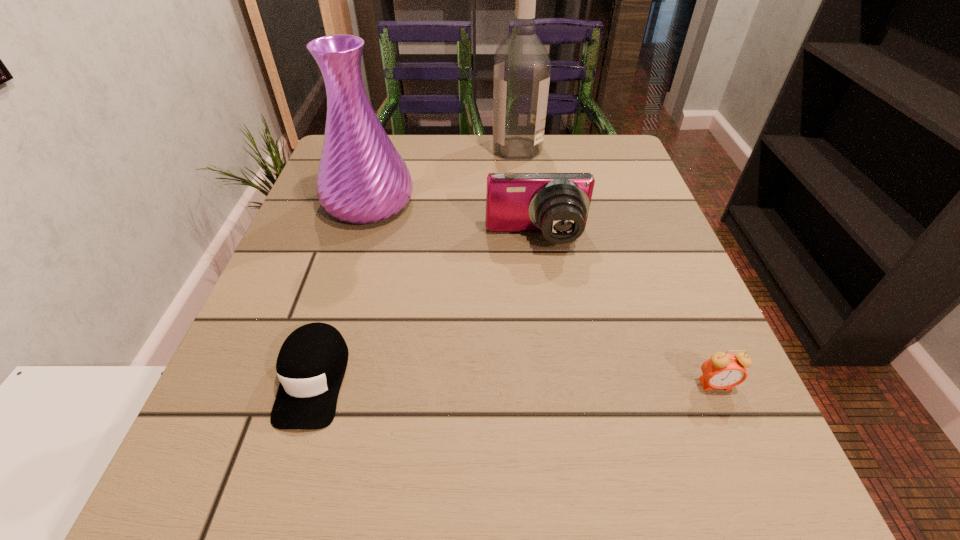
Locate an element on the screen. This screenshot has width=960, height=540. free space between the rightmost object and the third shortest object is located at coordinates (626, 312).

I want to click on unoccupied position between the cap and the fourth shortest object, so click(x=341, y=291).

The width and height of the screenshot is (960, 540). What are the coordinates of `free space between the shortest object and the fourth shortest object` in the screenshot? It's located at (341, 291).

At what (x,y) coordinates should I click in order to perform the action: click on vacant space in between the fourth shortest object and the camera. Please return your answer as a coordinate pair (x, y). The width and height of the screenshot is (960, 540). Looking at the image, I should click on (453, 221).

Where is `unoccupied area between the fourth tallest object and the third tallest object`? Image resolution: width=960 pixels, height=540 pixels. unoccupied area between the fourth tallest object and the third tallest object is located at coordinates coord(626,312).

Locate which object is the second closest to the camera. Please provide its 2D coordinates. Your answer should be formatted as a tuple, i.e. [(x, y)], where the tuple contains the x and y coordinates of a point satisfying the conditions above.

[(522, 68)]

You are a GUI agent. You are given a task and a screenshot of the screen. Output one action in this format:
    pyautogui.click(x=<x>, y=<y>)
    Task: Click on the object that is the second nearest to the fourth tallest object
    This screenshot has width=960, height=540.
    Given the screenshot: What is the action you would take?
    pyautogui.click(x=311, y=364)

Identify the location of vacant area in the image that satisfies the following two spatial constraints: 1. on the front-facing side of the farthest object; 2. on the front-facing side of the cap. (543, 380).

Find the location of a particular element. vacant region that satisfies the following two spatial constraints: 1. on the front-facing side of the farthest object; 2. on the front side of the vase is located at coordinates tap(523, 203).